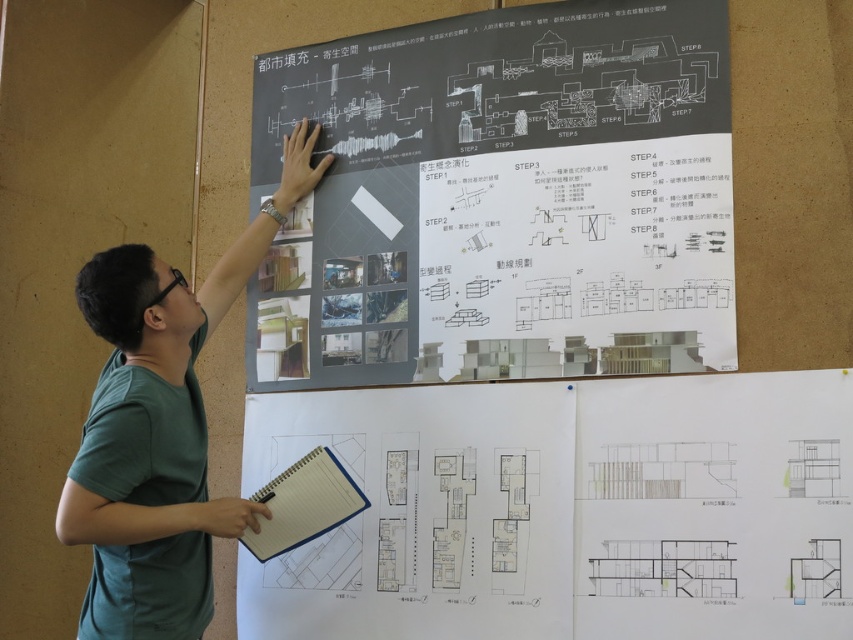
You are a student attending a presentation and need to take notes. The presenter is pointing at two points on the board. The first point is at coordinates point [117,406] and the second is at point [271,493]. Based on the presenter, which point is closer to you?

Point [117,406] is in front of point [271,493], so it is closer to you.

You are attending a presentation and see the white paper at lower center and the blue spiral notebook at lower center on the presentation board. Which object is positioned higher on the board?

The white paper at lower center is positioned higher than the blue spiral notebook at lower center on the presentation board.